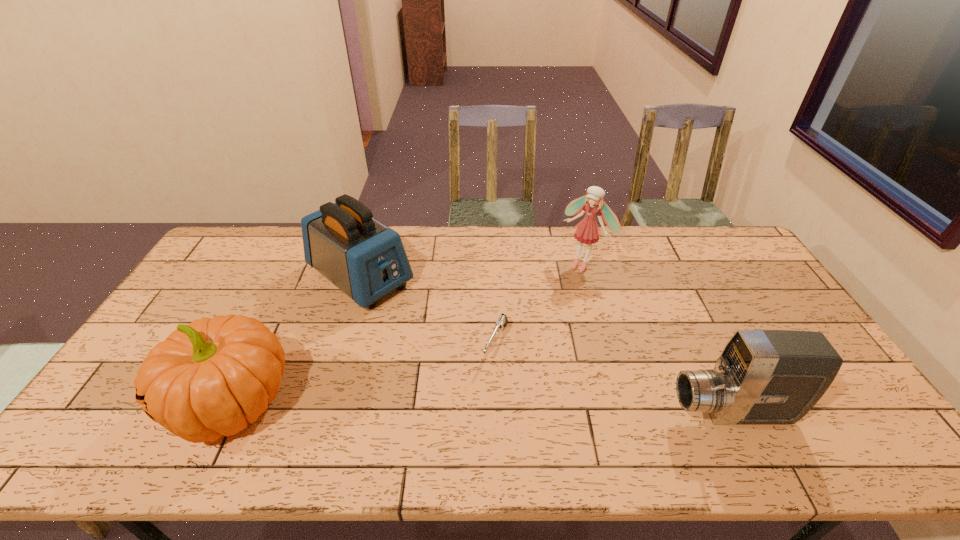
The height and width of the screenshot is (540, 960). What are the coordinates of `vacant area between the second object from right to left and the toaster` in the screenshot? It's located at (471, 271).

The width and height of the screenshot is (960, 540). I want to click on free space between the rightmost object and the second object from right to left, so click(658, 338).

What are the coordinates of `unoccupied area between the pumpkin and the third object from right to left` in the screenshot? It's located at (364, 374).

Where is `blank region between the toaster and the pistol`? This screenshot has width=960, height=540. blank region between the toaster and the pistol is located at coordinates (428, 310).

In order to click on vacant space that is in between the rightmost object and the pumpkin in this screenshot , I will do point(482,408).

The image size is (960, 540). I want to click on vacant region between the toaster and the third object from left to right, so click(428, 310).

Image resolution: width=960 pixels, height=540 pixels. I want to click on free space between the third object from left to right and the camcorder, so click(x=613, y=378).

You are a GUI agent. You are given a task and a screenshot of the screen. Output one action in this format:
    pyautogui.click(x=<x>, y=<y>)
    Task: Click on the object that is the second closest one to the pumpkin
    This screenshot has width=960, height=540.
    Given the screenshot: What is the action you would take?
    [502, 321]

Find the location of a particular element. The width and height of the screenshot is (960, 540). the closest object to the camcorder is located at coordinates (502, 321).

Where is `free location that satisfies the following two spatial constraints: 1. on the front side of the camcorder; 2. at the front of the toaster, highlighting the lens`? The width and height of the screenshot is (960, 540). free location that satisfies the following two spatial constraints: 1. on the front side of the camcorder; 2. at the front of the toaster, highlighting the lens is located at coordinates (318, 413).